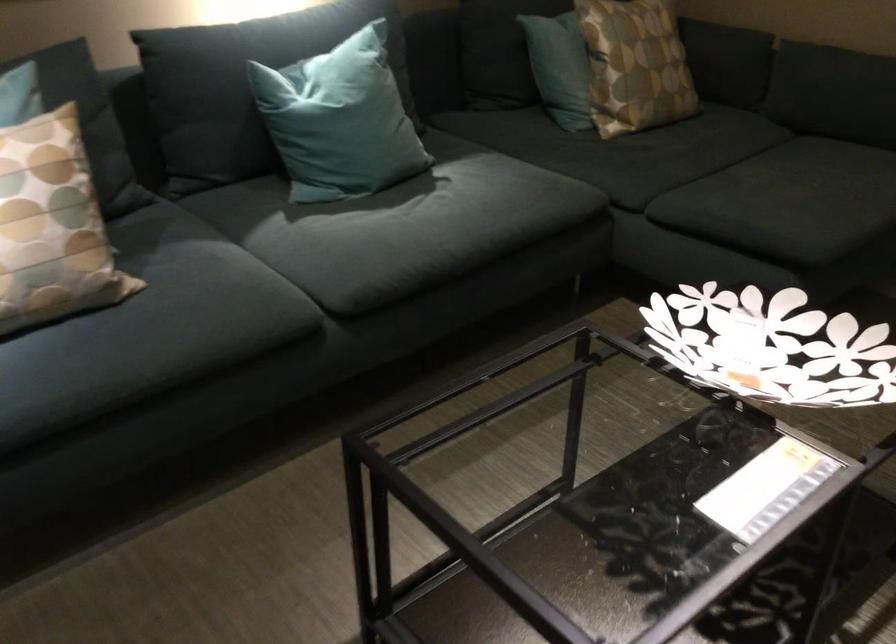
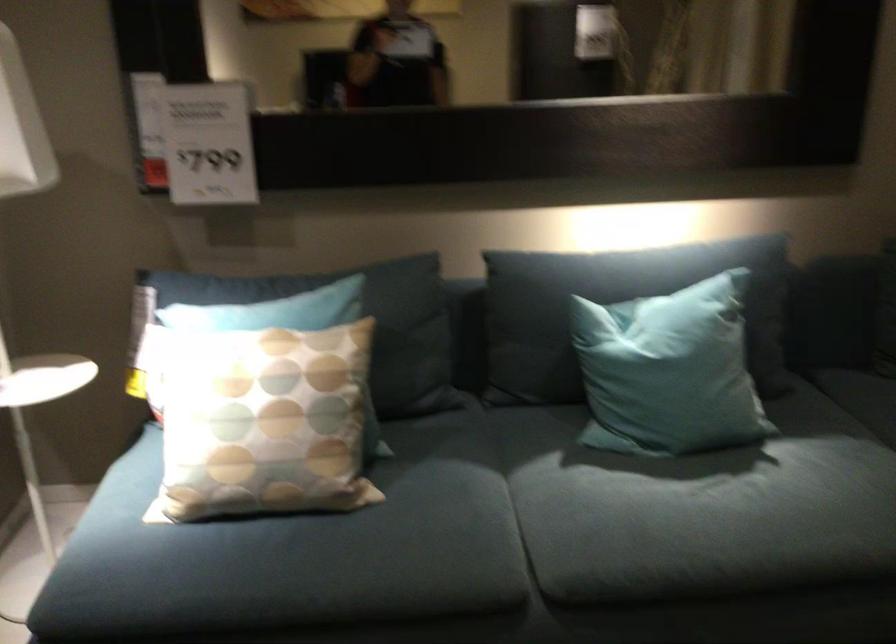
Where in the second image is the point corresponding to point 290,73 from the first image?

(616, 308)